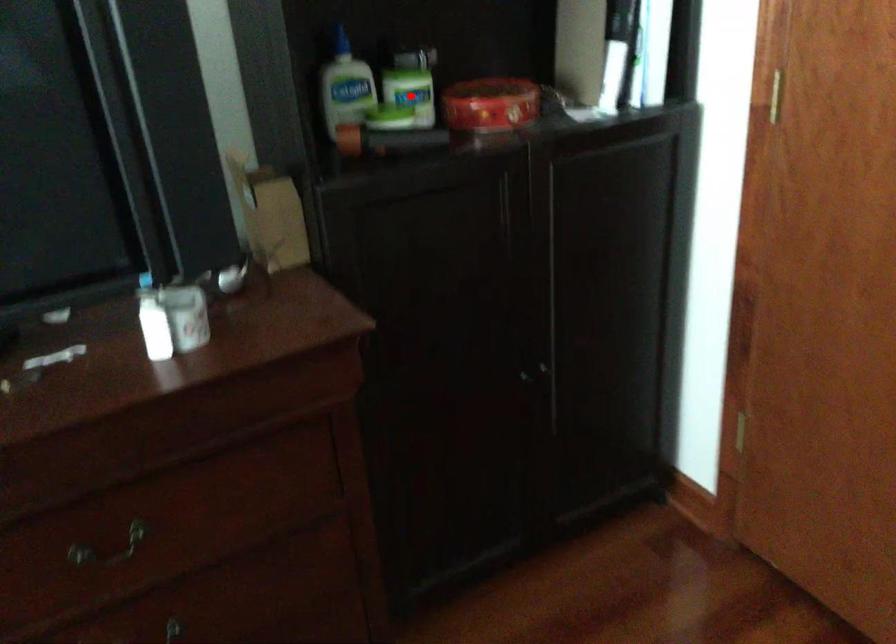
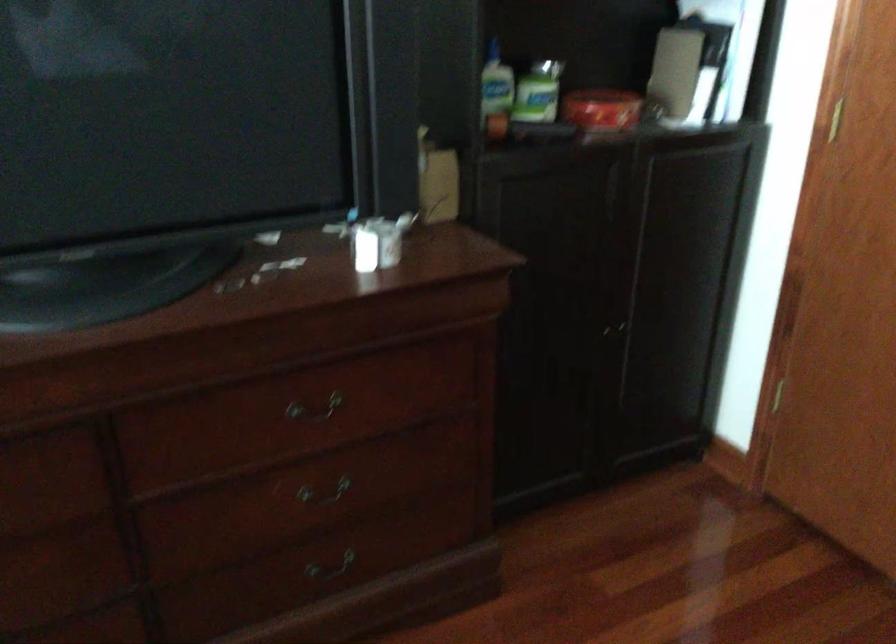
Question: I am providing you with two images of the same scene from different viewpoints. Given a red point in image1, look at the same physical point in image2. Is it:

Choices:
 (A) Closer to the viewpoint
 (B) Farther from the viewpoint

Answer: (B)